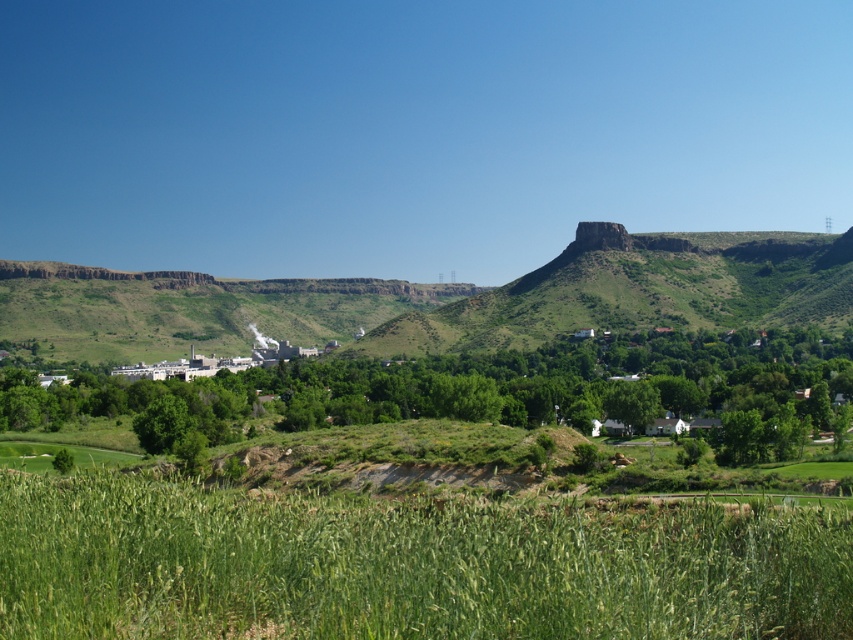
You are a drone operator planning to fly a drone from the green grassy field at lower center to the white industrial building at center. Considering the spatial relationship between them, which direction should you fly the drone to reach the building?

The green grassy field at lower center is thinner than the white industrial building at center, so you should fly the drone towards the thicker area where the white industrial building at center is located to reach it.

You are standing at point A, which is located at coordinates (407, 564). Looking at the image, what do you see directly in front of you?

At point A, you see the green grassy field at lower center directly in front of you.